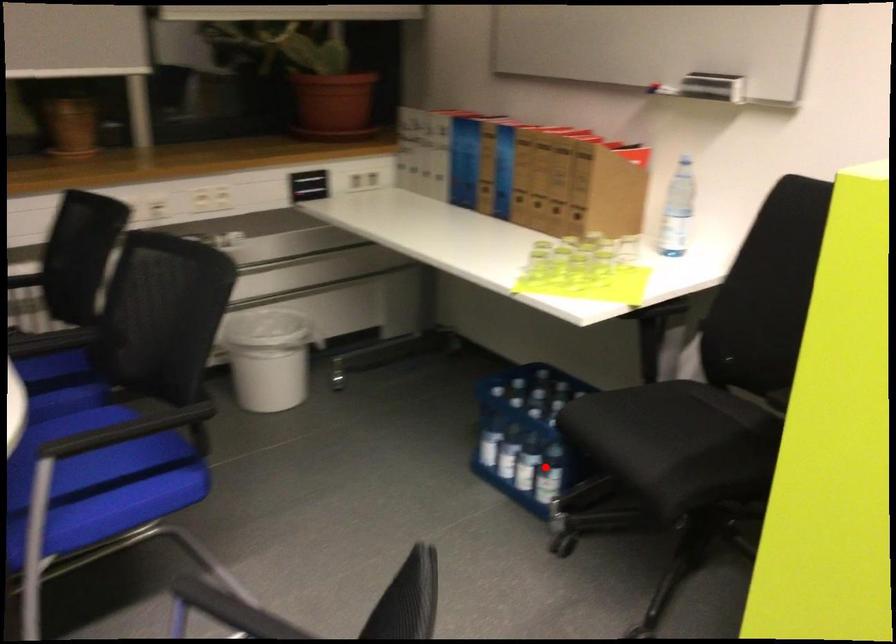
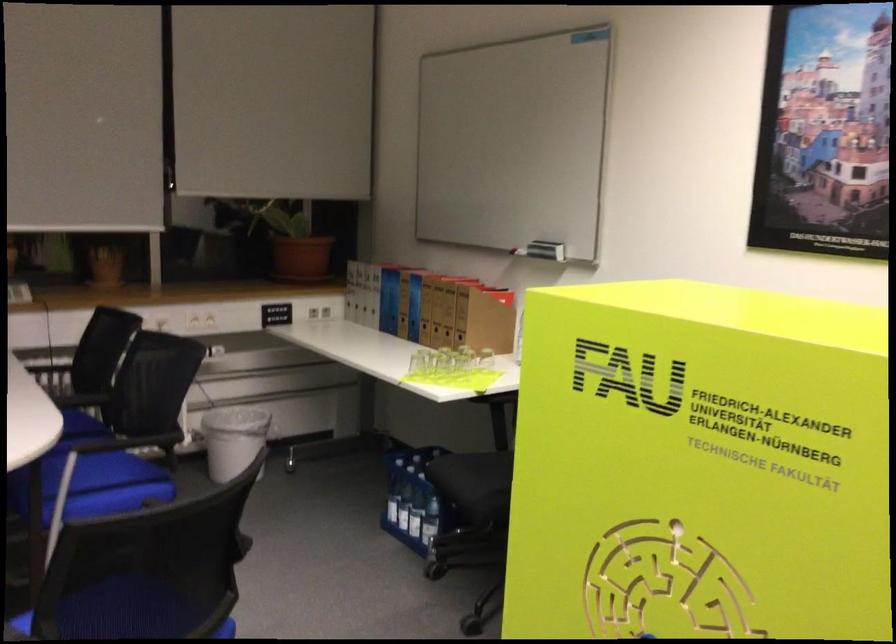
Locate, in the second image, the point that corresponds to the highlighted location in the first image.

(429, 520)